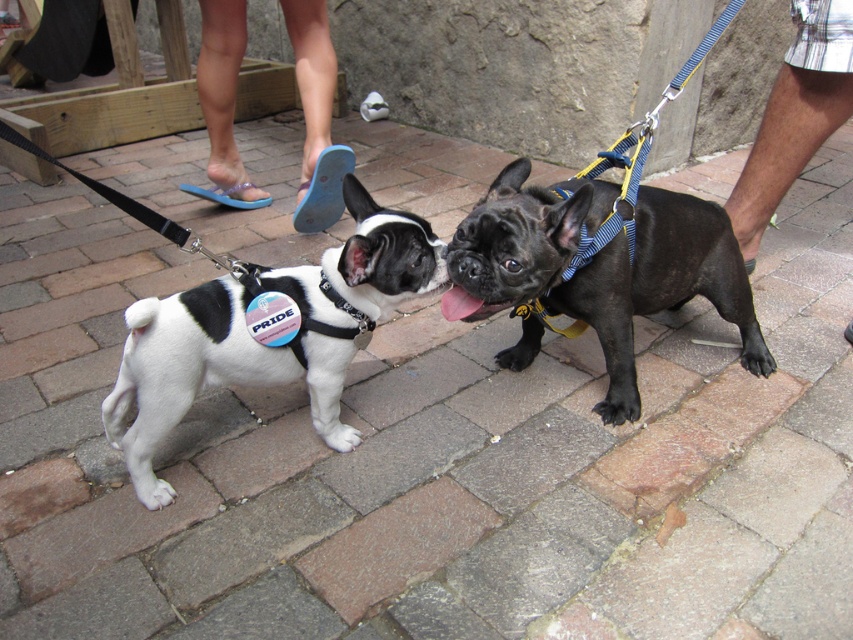
Question: Which of the following is the closest to the observer?

Choices:
 (A) black matte french bulldog at center
 (B) white matte/black harness at left

Answer: (A)

Question: Which of the following is the farthest from the observer?

Choices:
 (A) (103, 404)
 (B) (529, 291)

Answer: (A)

Question: In this image, where is black matte french bulldog at center located relative to white matte/black harness at left?

Choices:
 (A) right
 (B) left

Answer: (A)

Question: Which object is farther from the camera taking this photo?

Choices:
 (A) white matte/black harness at left
 (B) black matte french bulldog at center

Answer: (A)

Question: Where is black matte french bulldog at center located in relation to white matte/black harness at left in the image?

Choices:
 (A) below
 (B) above

Answer: (B)

Question: Can you confirm if black matte french bulldog at center is thinner than white matte/black harness at left?

Choices:
 (A) yes
 (B) no

Answer: (B)